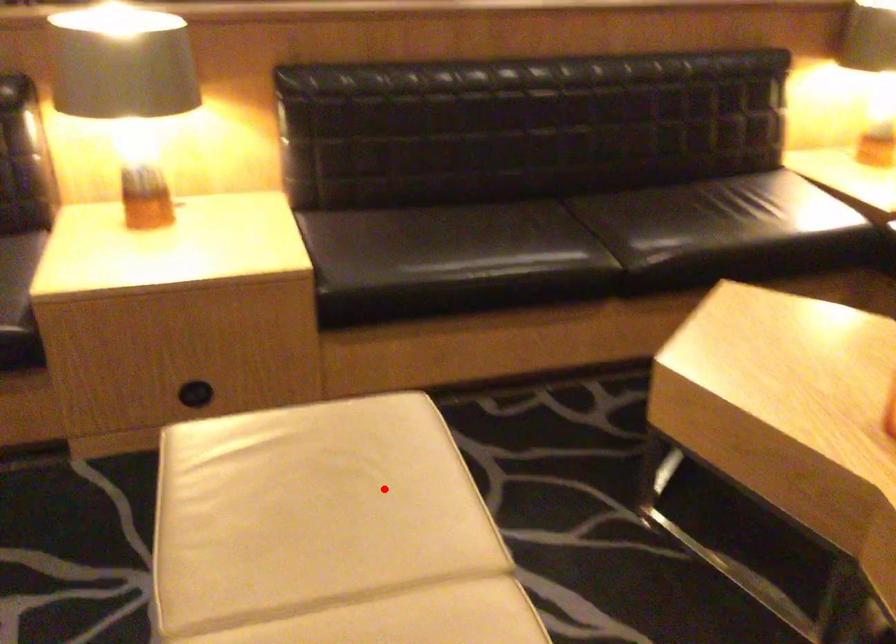
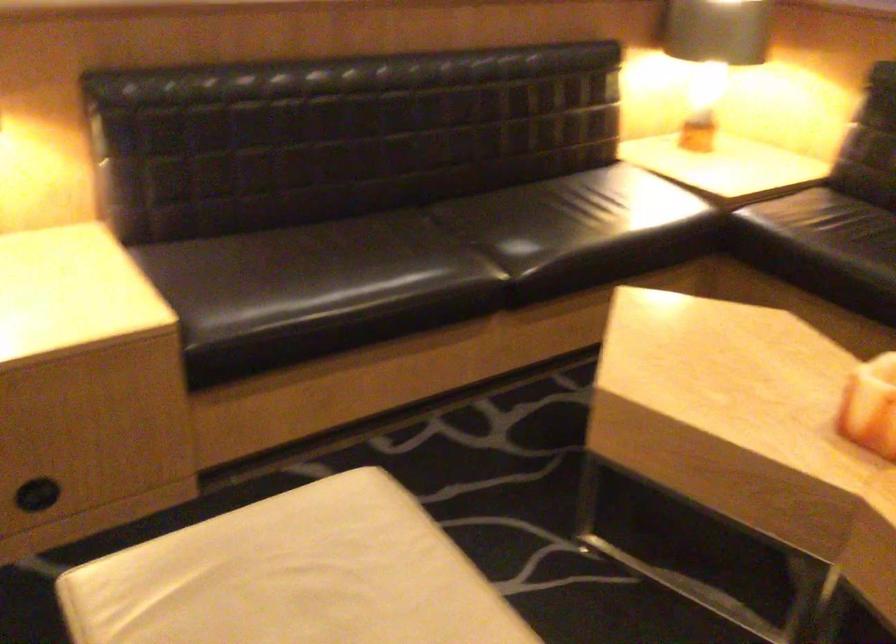
Where in the second image is the point corresponding to the highlighted location from the first image?

(391, 610)